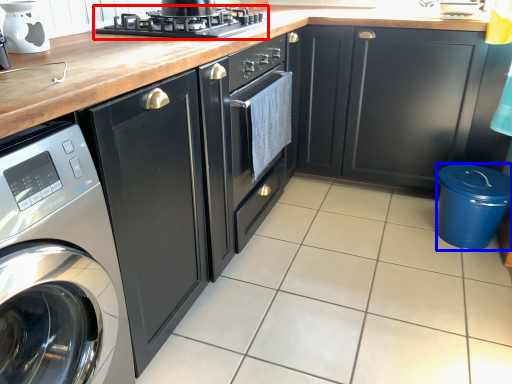
Question: Among these objects, which one is nearest to the camera, kitchen appliance (highlighted by a red box) or appliance (highlighted by a blue box)?

Choices:
 (A) kitchen appliance
 (B) appliance

Answer: (A)